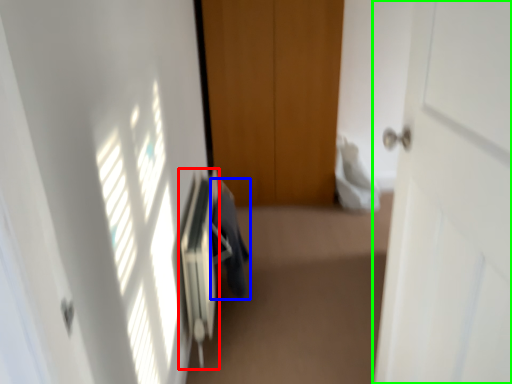
Question: Estimate the real-world distances between objects in this image. Which object is farther from radiator (highlighted by a red box), laundry (highlighted by a blue box) or door (highlighted by a green box)?

Choices:
 (A) laundry
 (B) door

Answer: (B)